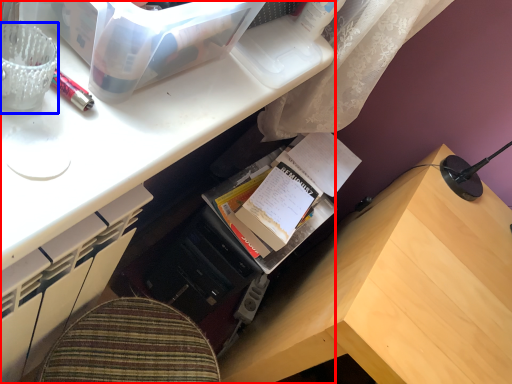
Question: Which point is further to the camera, desk (highlighted by a red box) or stationery (highlighted by a blue box)?

Choices:
 (A) desk
 (B) stationery

Answer: (B)